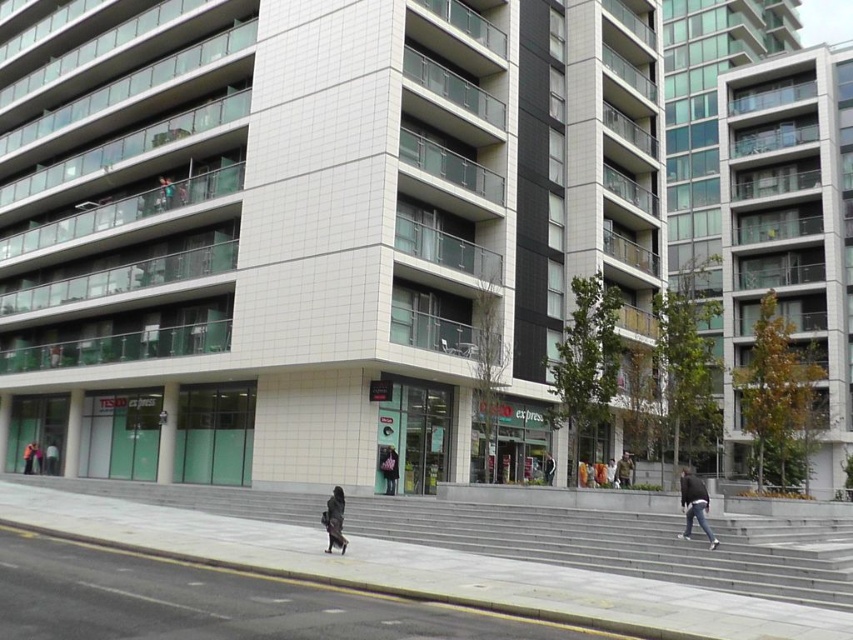
Does black leather jacket at center have a lesser width compared to dark gray jacket at lower left?

Yes, black leather jacket at center is thinner than dark gray jacket at lower left.

Which is in front, point (387, 461) or point (53, 458)?

Point (387, 461) is more forward.

Find the location of `black leather jacket at center`. black leather jacket at center is located at coordinates (389, 468).

Which is below, orange fabric bag at lower center or dark gray jacket at center?

Positioned lower is orange fabric bag at lower center.

Which is more to the right, orange fabric bag at lower center or dark gray jacket at center?

Positioned to the right is dark gray jacket at center.

Between point (32, 451) and point (554, 465), which one is positioned behind?

Point (32, 451)

At what (x,y) coordinates should I click in order to perform the action: click on orange fabric bag at lower center. Please return your answer as a coordinate pair (x, y). Image resolution: width=853 pixels, height=640 pixels. Looking at the image, I should click on (28, 458).

Is gray concrete pavement at lower center closer to the viewer compared to dark gray jacket at lower left?

Yes, it is.

Does gray concrete pavement at lower center have a greater height compared to dark gray jacket at lower left?

Yes.

Is point (112, 563) farther from camera compared to point (47, 452)?

No, (112, 563) is closer to viewer.

Locate an element on the screen. This screenshot has height=640, width=853. gray concrete pavement at lower center is located at coordinates (215, 602).